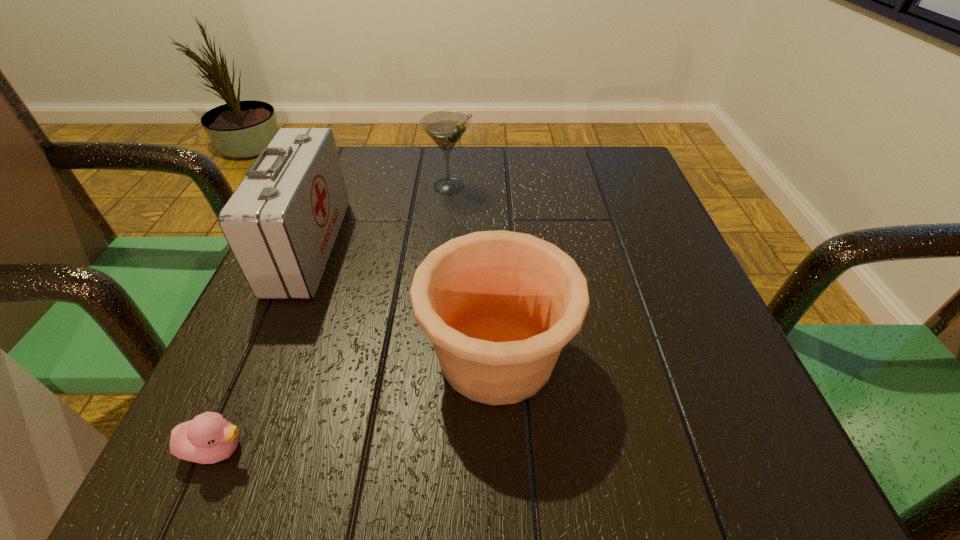
I want to click on free space between the shortest object and the pottery, so click(357, 402).

The image size is (960, 540). What are the coordinates of `object that is the second nearest to the farthest object` in the screenshot? It's located at (499, 306).

Identify the location of the third closest object relative to the first-aid kit. (208, 438).

The width and height of the screenshot is (960, 540). Identify the location of vacant area in the image that satisfies the following two spatial constraints: 1. on the front side of the farthest object; 2. on the front-facing side of the nearest object. (425, 449).

Where is `vacant region that satisfies the following two spatial constraints: 1. on the front side of the farthest object; 2. on the front-facing side of the first-aid kit`? vacant region that satisfies the following two spatial constraints: 1. on the front side of the farthest object; 2. on the front-facing side of the first-aid kit is located at coordinates (444, 246).

Where is `free spot that satisfies the following two spatial constraints: 1. on the front side of the martini; 2. on the front-facing side of the duckling`? Image resolution: width=960 pixels, height=540 pixels. free spot that satisfies the following two spatial constraints: 1. on the front side of the martini; 2. on the front-facing side of the duckling is located at coordinates (425, 449).

Find the location of a particular element. vacant space that satisfies the following two spatial constraints: 1. on the front-facing side of the second shortest object; 2. on the right side of the first-aid kit is located at coordinates (262, 355).

Find the location of a particular element. This screenshot has width=960, height=540. free point that satisfies the following two spatial constraints: 1. on the back side of the second shortest object; 2. on the front-facing side of the first-aid kit is located at coordinates (493, 246).

Locate an element on the screen. vacant space that satisfies the following two spatial constraints: 1. on the front side of the pottery; 2. on the front-facing side of the duckling is located at coordinates (499, 449).